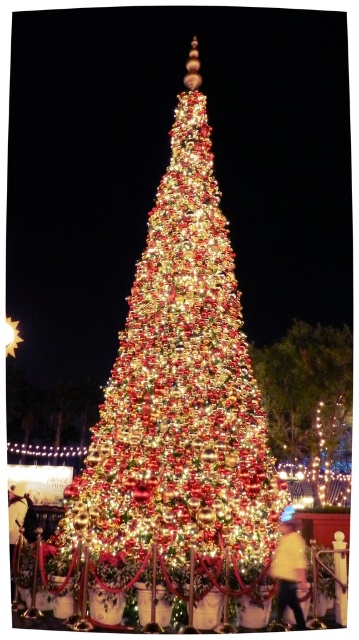
Who is shorter, iridescent glass christmas tree at center or silk red dress at lower left?

silk red dress at lower left

Who is more forward, (86, 458) or (26, 497)?

Point (86, 458) is in front.

Between point (182, 225) and point (31, 525), which one is positioned in front?

Point (182, 225) is in front.

At what (x,y) coordinates should I click in order to perform the action: click on iridescent glass christmas tree at center. Please return your answer as a coordinate pair (x, y). The height and width of the screenshot is (640, 359). Looking at the image, I should click on (179, 410).

Which is more to the left, shiny gold ornaments at center or yellow cotton shirt at lower right?

yellow cotton shirt at lower right

Is shiny gold ornaments at center to the left of yellow cotton shirt at lower right from the viewer's perspective?

In fact, shiny gold ornaments at center is to the right of yellow cotton shirt at lower right.

Measure the distance between point (351, 397) and camera.

Point (351, 397) and camera are 318.97 feet apart from each other.

This screenshot has height=640, width=359. I want to click on shiny gold ornaments at center, so click(306, 388).

Is the position of iridescent glass christmas tree at center less distant than that of shiny gold ornaments at center?

That is True.

Between point (211, 401) and point (281, 429), which one is positioned in front?

Point (211, 401)

Find the location of a particular element. The image size is (359, 640). iridescent glass christmas tree at center is located at coordinates (179, 410).